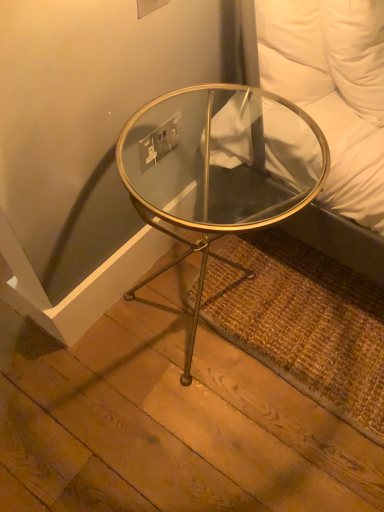
Where is `vacant point to the right of clear glass table at center`? This screenshot has height=512, width=384. vacant point to the right of clear glass table at center is located at coordinates (317, 326).